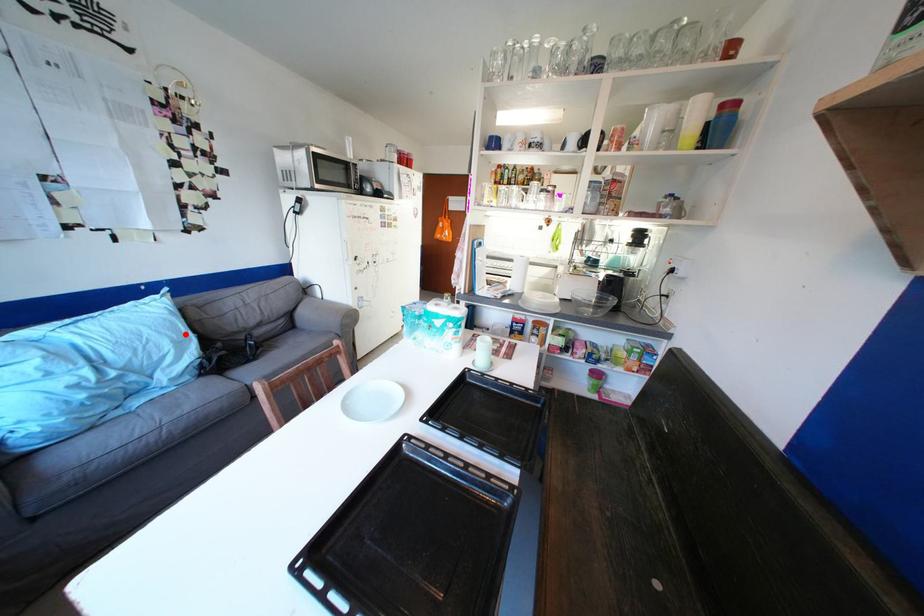
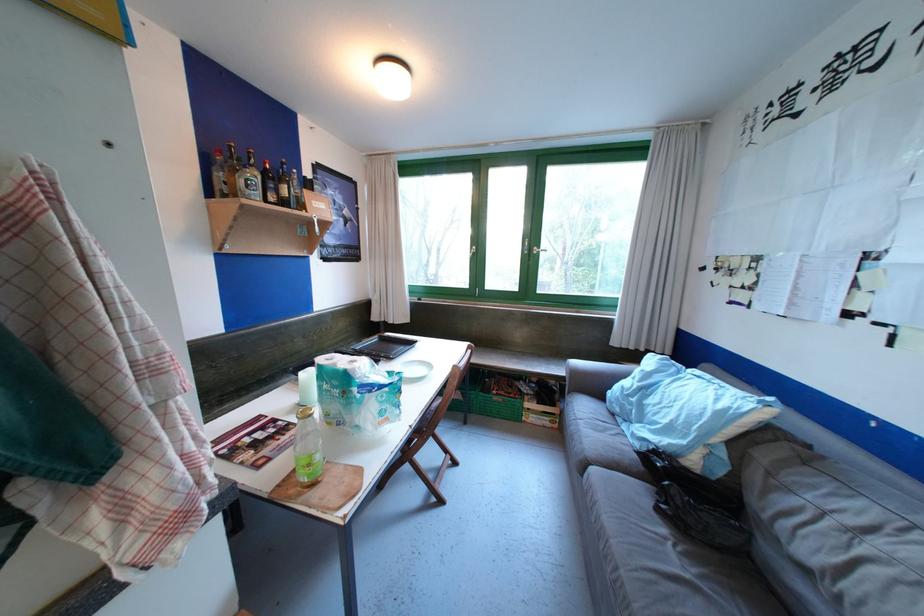
Question: I am providing you with two images of the same scene from different viewpoints. In image1, a red point is highlighted. Considering the same 3D point in image2, which of the following is correct?

Choices:
 (A) It is closer
 (B) It is farther

Answer: (B)